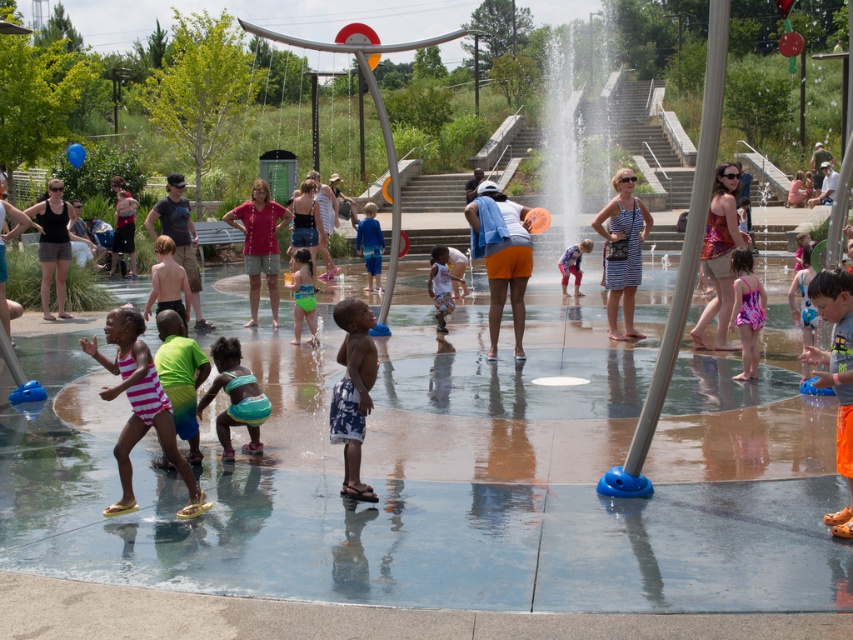
You are a parent watching your child play in the splash park. You notice the transparent plastic water at center and the matte pink shirt at center. Which object is positioned lower in the scene?

The transparent plastic water at center is below matte pink shirt at center, so the transparent plastic water at center is positioned lower in the scene.

You are a parent watching your child play in the splash park. You see the transparent plastic water at center and the matte pink shirt at center. Which object is wider from your viewpoint?

The transparent plastic water at center is wider than the matte pink shirt at center.

What is located at the coordinates point (138,406)?

The striped cotton swimsuit at lower left is located at point (138,406).